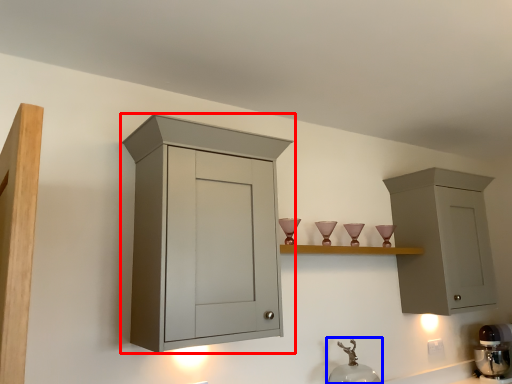
Question: Which object is further to the camera taking this photo, cabinetry (highlighted by a red box) or faucet (highlighted by a blue box)?

Choices:
 (A) cabinetry
 (B) faucet

Answer: (B)